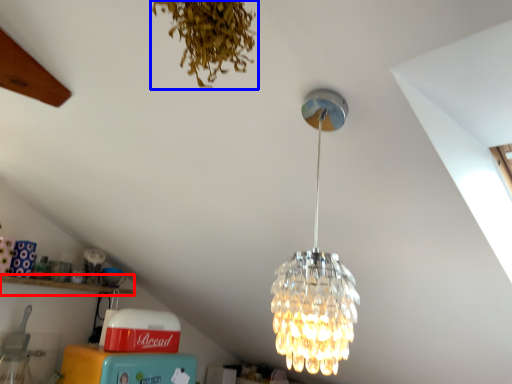
Question: Which object is further to the camera taking this photo, shelf (highlighted by a red box) or plant (highlighted by a blue box)?

Choices:
 (A) shelf
 (B) plant

Answer: (A)